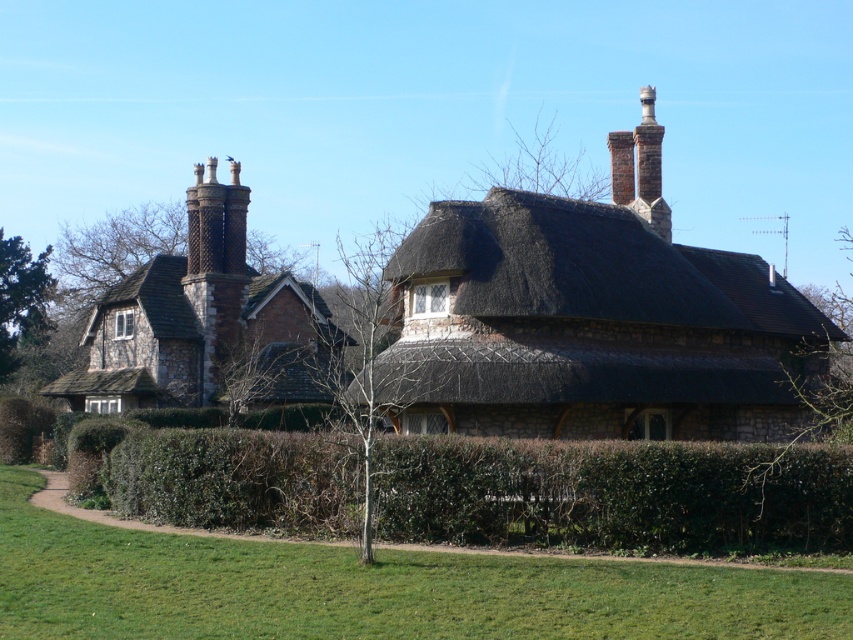
You are a gardener planning to trim the green leafy tree at center and the bare branches at upper right. Considering their sizes, which one requires more time and effort?

The green leafy tree at center requires more time and effort because it has a larger size compared to the bare branches at upper right.

You are standing in front of the two stone houses and notice the rustic stone chimney at upper left and the green leafy tree at left. Which object is positioned to the right of the other?

The rustic stone chimney at upper left is to the right of the green leafy tree at left.